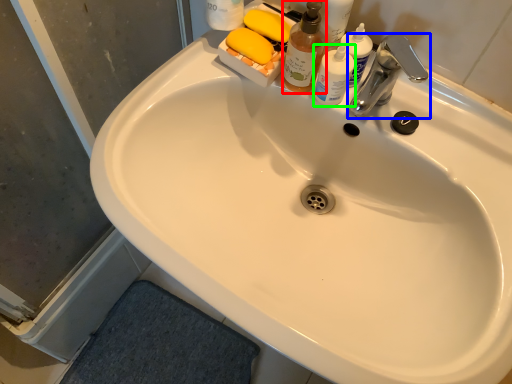
Question: Which object is the farthest from cleaning product (highlighted by a red box)? Choose among these: tap (highlighted by a blue box) or toiletry (highlighted by a green box).

Choices:
 (A) tap
 (B) toiletry

Answer: (A)